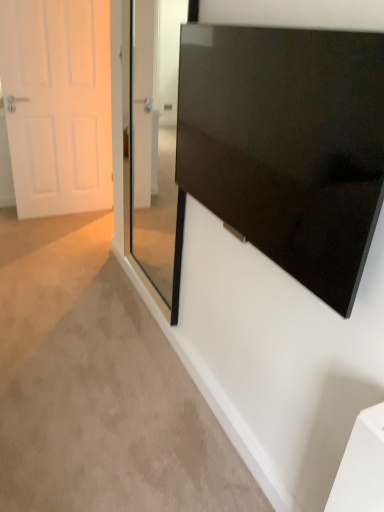
Question: Is transparent glass door at center aimed at white matte door at left?

Choices:
 (A) no
 (B) yes

Answer: (A)

Question: From the image's perspective, would you say transparent glass door at center is shown under white matte door at left?

Choices:
 (A) no
 (B) yes

Answer: (B)

Question: Is transparent glass door at center taller than white matte door at left?

Choices:
 (A) no
 (B) yes

Answer: (A)

Question: Is transparent glass door at center at the right side of white matte door at left?

Choices:
 (A) no
 (B) yes

Answer: (B)

Question: From a real-world perspective, does transparent glass door at center sit lower than white matte door at left?

Choices:
 (A) yes
 (B) no

Answer: (B)

Question: Looking at their shapes, would you say white matte door at left is wider or thinner than glossy black screen at upper right?

Choices:
 (A) thin
 (B) wide

Answer: (B)

Question: Considering the positions of white matte door at left and glossy black screen at upper right in the image, is white matte door at left bigger or smaller than glossy black screen at upper right?

Choices:
 (A) small
 (B) big

Answer: (B)

Question: From a real-world perspective, is white matte door at left positioned above or below glossy black screen at upper right?

Choices:
 (A) below
 (B) above

Answer: (A)

Question: Choose the correct answer: Is white matte door at left inside glossy black screen at upper right or outside it?

Choices:
 (A) inside
 (B) outside

Answer: (B)

Question: Relative to white matte door at left, is transparent glass door at center in front or behind?

Choices:
 (A) front
 (B) behind

Answer: (A)

Question: Visually, is transparent glass door at center positioned to the left or to the right of white matte door at left?

Choices:
 (A) right
 (B) left

Answer: (A)

Question: Considering the positions of transparent glass door at center and white matte door at left in the image, is transparent glass door at center bigger or smaller than white matte door at left?

Choices:
 (A) big
 (B) small

Answer: (B)

Question: From a real-world perspective, is transparent glass door at center physically located above or below white matte door at left?

Choices:
 (A) below
 (B) above

Answer: (B)

Question: Is transparent glass door at center in front of or behind glossy black screen at upper right in the image?

Choices:
 (A) front
 (B) behind

Answer: (B)

Question: Is transparent glass door at center taller or shorter than glossy black screen at upper right?

Choices:
 (A) tall
 (B) short

Answer: (A)